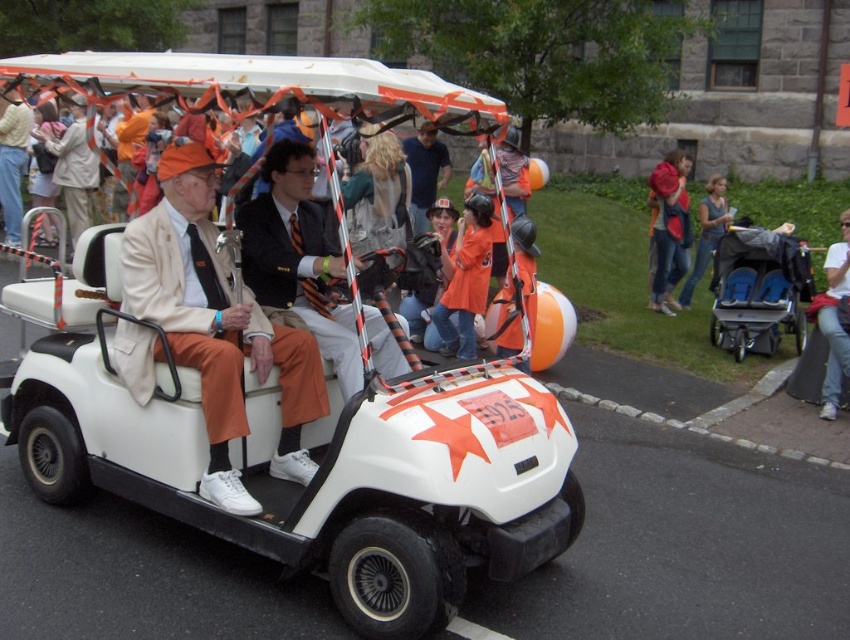
Question: Does white matte golf cart at center have a larger size compared to orange matte jacket at center?

Choices:
 (A) yes
 (B) no

Answer: (A)

Question: Which object is closer to the camera taking this photo?

Choices:
 (A) jeans at lower right
 (B) orange suit at center
 (C) denim jeans at lower right
 (D) orange matte jacket at center

Answer: (B)

Question: Which is nearer to the matte beige suit at left?

Choices:
 (A) orange matte jacket at center
 (B) orange fabric hat at center

Answer: (A)

Question: Considering the relative positions of orange suit at center and denim jacket at upper right in the image provided, where is orange suit at center located with respect to denim jacket at upper right?

Choices:
 (A) right
 (B) left

Answer: (B)

Question: Which of these objects is positioned farthest from the orange matte jacket at center?

Choices:
 (A) orange fabric hat at center
 (B) jeans at lower right

Answer: (B)

Question: Is white matte golf cart at center to the right of orange suit at center from the viewer's perspective?

Choices:
 (A) yes
 (B) no

Answer: (B)